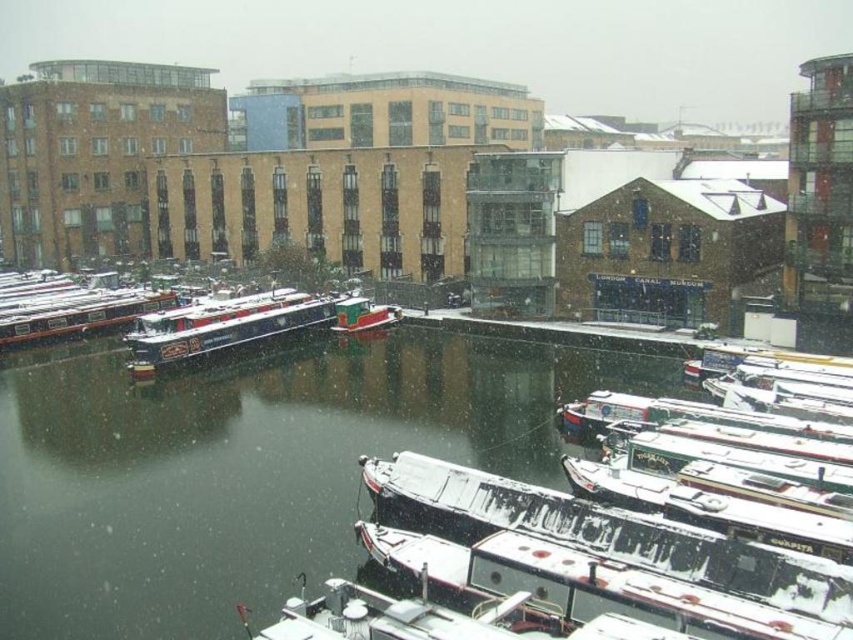
You are standing on the dock and see the white glossy boat at lower center and the green matte boat at center. Which boat is closer to the left side of the dock?

The green matte boat at center is closer to the left side of the dock because the white glossy boat at lower center is positioned on the right side of it.